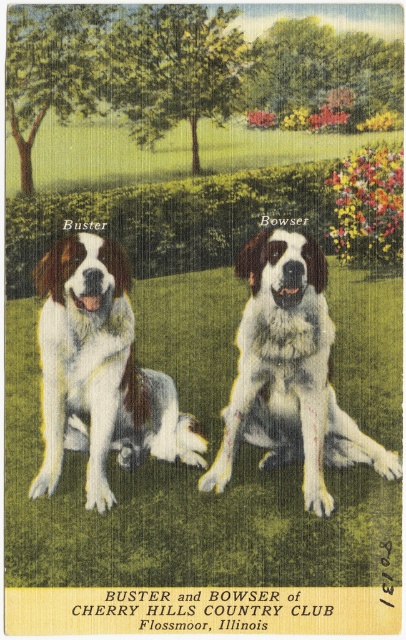
Question: Is white fur dog at center positioned before white fur saint bernard at center?

Choices:
 (A) yes
 (B) no

Answer: (B)

Question: Can you confirm if white fur dog at center is positioned to the right of white fur saint bernard at center?

Choices:
 (A) no
 (B) yes

Answer: (A)

Question: Does white fur dog at center have a lesser width compared to white fur saint bernard at center?

Choices:
 (A) no
 (B) yes

Answer: (B)

Question: Which of the following is the closest to the observer?

Choices:
 (A) (161, 390)
 (B) (397, 456)

Answer: (B)

Question: Which point is farther to the camera?

Choices:
 (A) white fur saint bernard at center
 (B) white fur dog at center

Answer: (B)